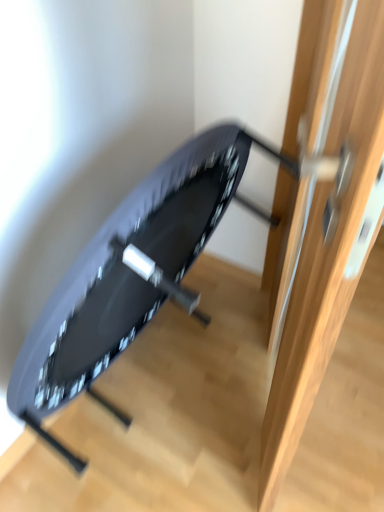
Image resolution: width=384 pixels, height=512 pixels. What are the coordinates of `vacant region to the left of wooden door at center` in the screenshot? It's located at (167, 405).